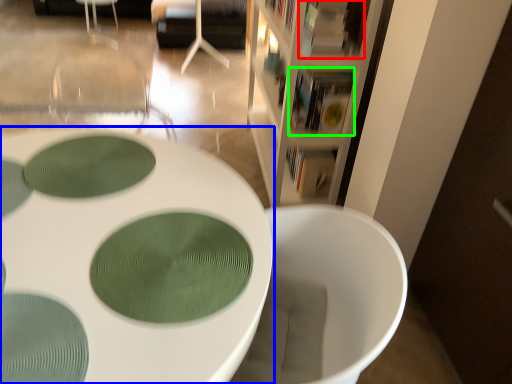
Question: Estimate the real-world distances between objects in this image. Which object is closer to book (highlighted by a red box), table (highlighted by a blue box) or book (highlighted by a green box)?

Choices:
 (A) table
 (B) book

Answer: (B)